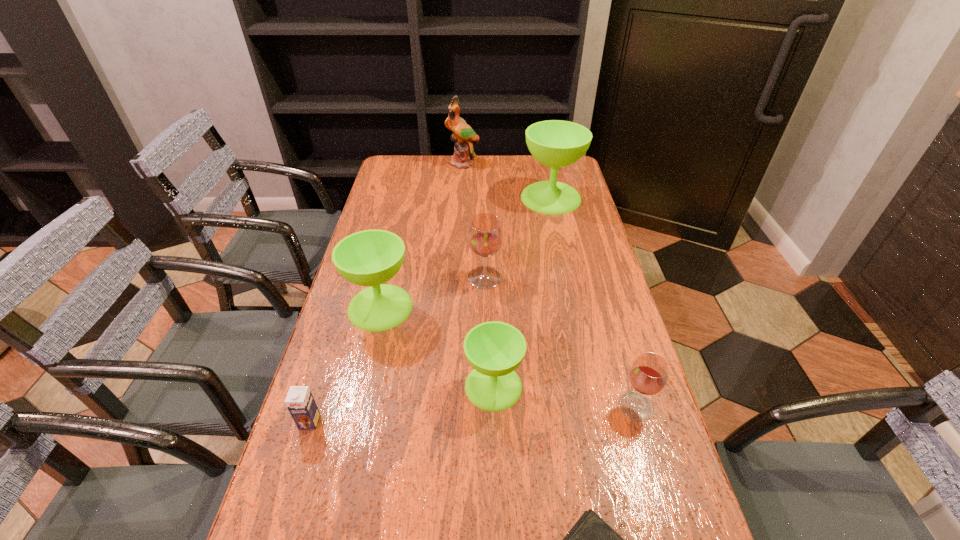
Identify which wineglass is located as the third nearest to the leftmost wineglass. Please provide its 2D coordinates. Your answer should be formatted as a tuple, i.e. [(x, y)], where the tuple contains the x and y coordinates of a point satisfying the conditions above.

[(555, 143)]

Choose which wineglass is the second nearest neighbor to the nearest green wineglass. Please provide its 2D coordinates. Your answer should be formatted as a tuple, i.e. [(x, y)], where the tuple contains the x and y coordinates of a point satisfying the conditions above.

[(648, 375)]

Locate an element on the screen. green wineglass identified as the third closest to the seventh tallest object is located at coordinates pos(555,143).

Identify which green wineglass is the second closest to the nearest green wineglass. Please provide its 2D coordinates. Your answer should be formatted as a tuple, i.e. [(x, y)], where the tuple contains the x and y coordinates of a point satisfying the conditions above.

[(555, 143)]

The image size is (960, 540). In order to click on free space that satisfies the following two spatial constraints: 1. on the front-facing side of the farthest object; 2. on the right side of the biggest green wineglass in this screenshot , I will do `click(461, 198)`.

This screenshot has height=540, width=960. Find the location of `free space that satisfies the following two spatial constraints: 1. on the front-facing side of the farther red wineglass; 2. on the left side of the green parrot`. free space that satisfies the following two spatial constraints: 1. on the front-facing side of the farther red wineglass; 2. on the left side of the green parrot is located at coordinates (456, 278).